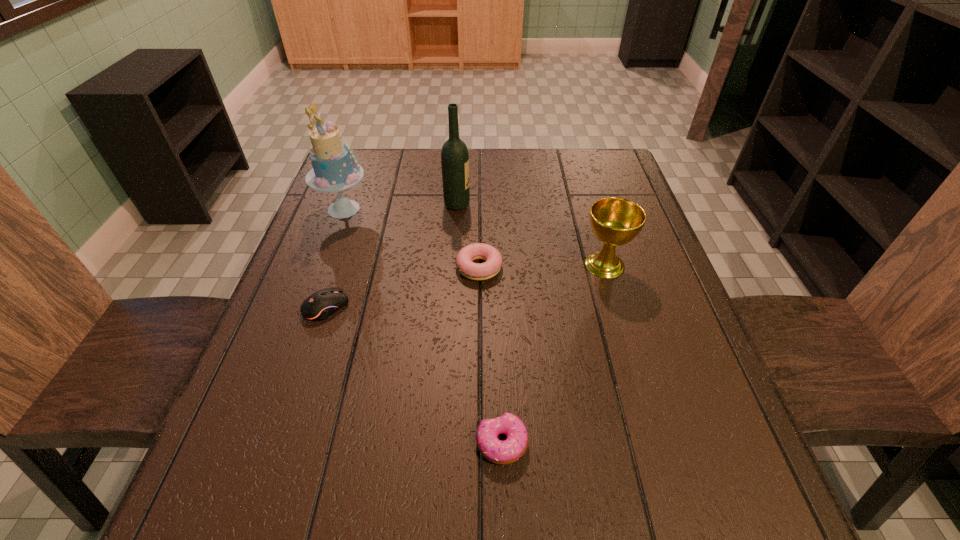
You are a GUI agent. You are given a task and a screenshot of the screen. Output one action in this format:
    pyautogui.click(x=<x>, y=<y>)
    Task: Click on the free point that satisfies the following two spatial constraints: 1. on the back side of the fourth shortest object; 2. with a ladder on the side of the cake
    
    Given the screenshot: What is the action you would take?
    pyautogui.click(x=588, y=209)

The height and width of the screenshot is (540, 960). Identify the location of vacant point that satisfies the following two spatial constraints: 1. with a ladder on the side of the farther doughnut; 2. on the left side of the cake. (323, 267).